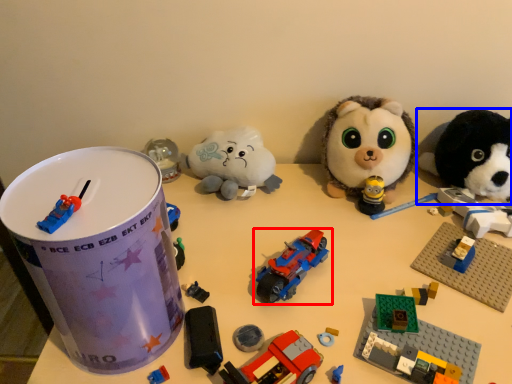
Question: Which point is further to the camera, toy (highlighted by a red box) or toy (highlighted by a blue box)?

Choices:
 (A) toy
 (B) toy

Answer: (B)